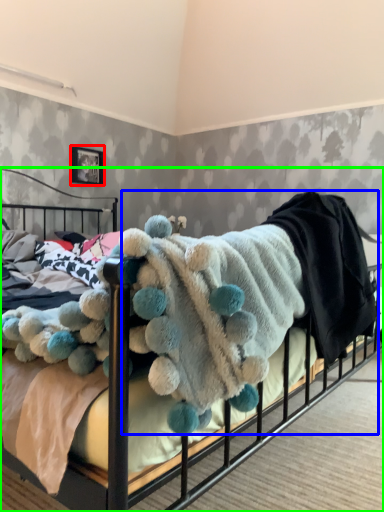
Question: Considering the real-world distances, which object is farthest from picture frame (highlighted by a red box)? baby clothe (highlighted by a blue box) or bed (highlighted by a green box)?

Choices:
 (A) baby clothe
 (B) bed

Answer: (B)